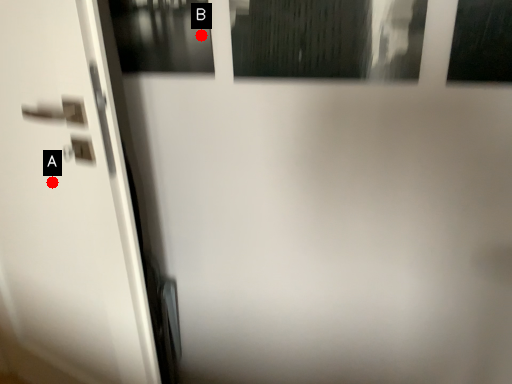
Question: Two points are circled on the image, labeled by A and B beside each circle. Which point appears farthest from the camera in this image?

Choices:
 (A) A is further
 (B) B is further

Answer: (A)